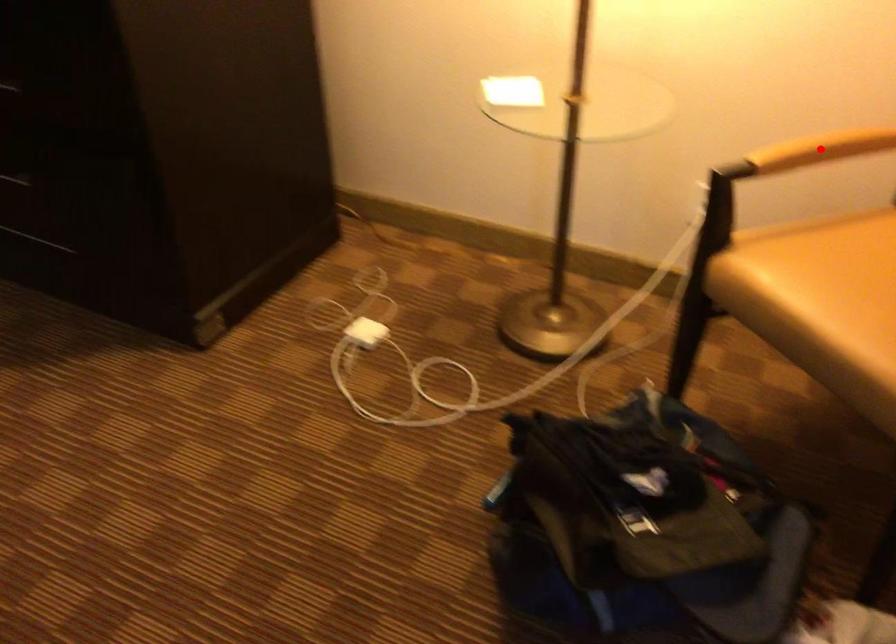
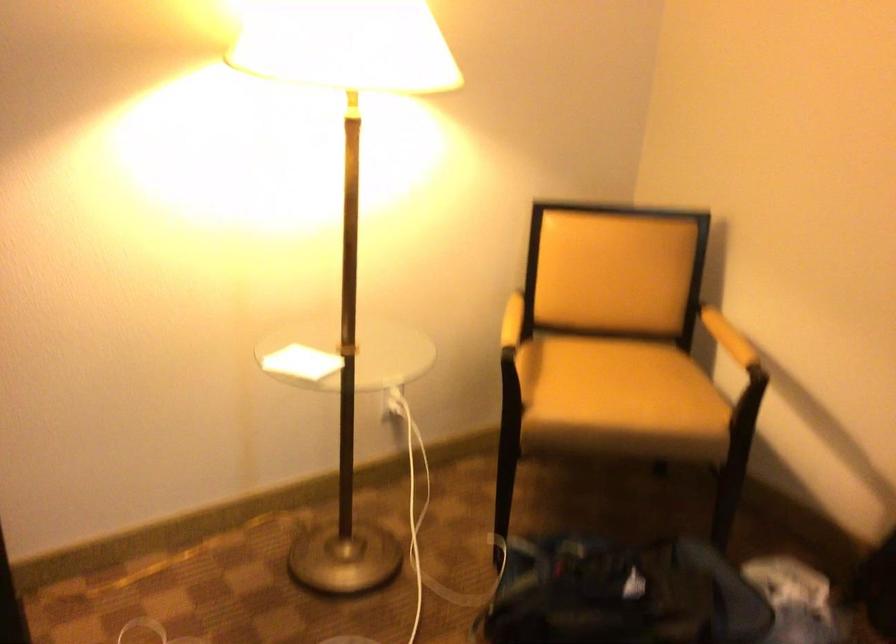
Question: I am providing you with two images of the same scene from different viewpoints. A red point is shown in image1. For the corresponding object point in image2, is it positioned nearer or farther from the camera?

Choices:
 (A) Nearer
 (B) Farther

Answer: (B)